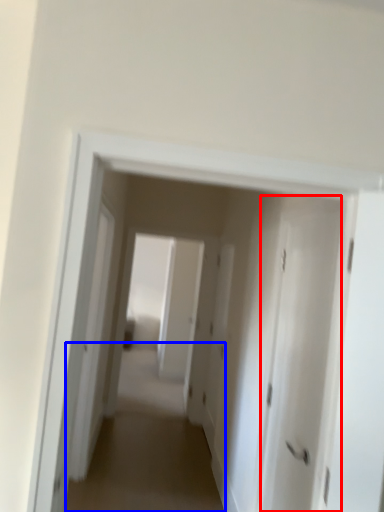
Question: Which object is closer to the camera taking this photo, door (highlighted by a red box) or alley (highlighted by a blue box)?

Choices:
 (A) door
 (B) alley

Answer: (A)